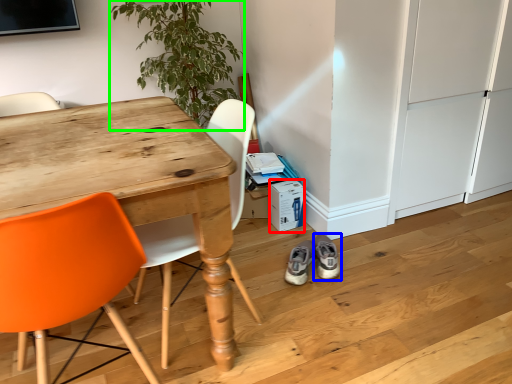
Question: Estimate the real-world distances between objects in this image. Which object is farther from box (highlighted by a red box), footwear (highlighted by a blue box) or houseplant (highlighted by a green box)?

Choices:
 (A) footwear
 (B) houseplant

Answer: (B)